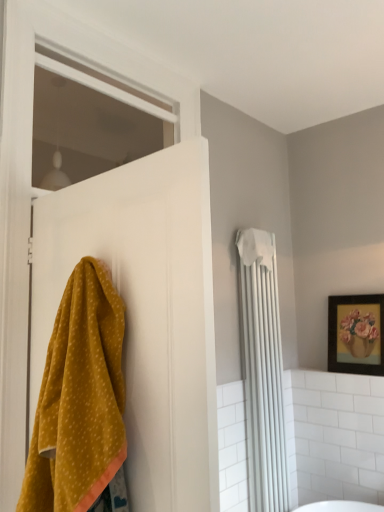
Question: Does white fabric towel at upper right appear on the left side of mustard yellow towel at left?

Choices:
 (A) no
 (B) yes

Answer: (A)

Question: Are white fabric towel at upper right and mustard yellow towel at left located far from each other?

Choices:
 (A) no
 (B) yes

Answer: (B)

Question: From the image's perspective, would you say white fabric towel at upper right is shown under mustard yellow towel at left?

Choices:
 (A) yes
 (B) no

Answer: (A)

Question: Does white fabric towel at upper right appear on the right side of mustard yellow towel at left?

Choices:
 (A) yes
 (B) no

Answer: (A)

Question: From the image's perspective, is white fabric towel at upper right located above mustard yellow towel at left?

Choices:
 (A) no
 (B) yes

Answer: (A)

Question: Is white fabric towel at upper right beside mustard yellow towel at left?

Choices:
 (A) yes
 (B) no

Answer: (B)

Question: From the image's perspective, would you say mustard yellow towel at left is shown under wooden framed painting at upper right?

Choices:
 (A) yes
 (B) no

Answer: (B)

Question: Is mustard yellow towel at left directly adjacent to wooden framed painting at upper right?

Choices:
 (A) no
 (B) yes

Answer: (A)

Question: From a real-world perspective, is mustard yellow towel at left over wooden framed painting at upper right?

Choices:
 (A) no
 (B) yes

Answer: (A)

Question: Would you say mustard yellow towel at left is a long distance from wooden framed painting at upper right?

Choices:
 (A) no
 (B) yes

Answer: (B)

Question: Is mustard yellow towel at left at the right side of wooden framed painting at upper right?

Choices:
 (A) yes
 (B) no

Answer: (B)

Question: Is mustard yellow towel at left shorter than wooden framed painting at upper right?

Choices:
 (A) no
 (B) yes

Answer: (A)

Question: From a real-world perspective, is wooden framed painting at upper right physically above white fabric towel at upper right?

Choices:
 (A) yes
 (B) no

Answer: (A)